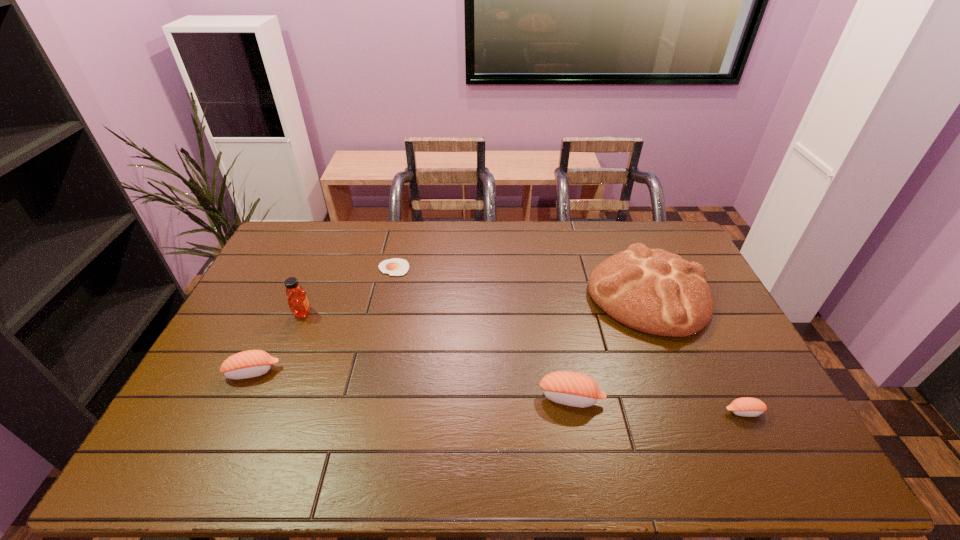
Where is `vacant spot for a new sushi to ensure equal spacing`? vacant spot for a new sushi to ensure equal spacing is located at coordinates (408, 384).